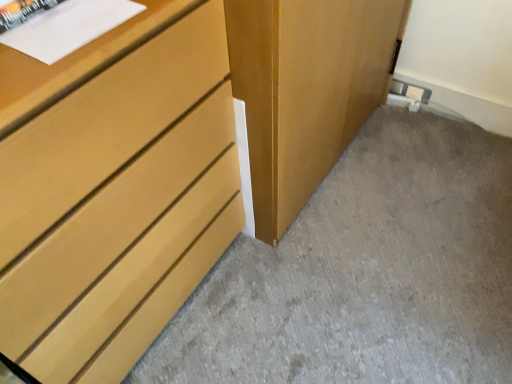
Question: From a real-world perspective, is matte wood dresser at lower left physically located above or below matte wood chest of drawers at left?

Choices:
 (A) above
 (B) below

Answer: (B)

Question: Based on their sizes in the image, would you say matte wood dresser at lower left is bigger or smaller than matte wood chest of drawers at left?

Choices:
 (A) small
 (B) big

Answer: (A)

Question: Relative to matte wood chest of drawers at left, is matte wood dresser at lower left in front or behind?

Choices:
 (A) behind
 (B) front

Answer: (A)

Question: From the image's perspective, relative to matte wood dresser at lower left, is matte wood chest of drawers at left above or below?

Choices:
 (A) below
 (B) above

Answer: (B)

Question: Relative to matte wood dresser at lower left, is matte wood chest of drawers at left in front or behind?

Choices:
 (A) behind
 (B) front

Answer: (B)

Question: Considering the positions of matte wood chest of drawers at left and matte wood dresser at lower left in the image, is matte wood chest of drawers at left bigger or smaller than matte wood dresser at lower left?

Choices:
 (A) small
 (B) big

Answer: (B)

Question: In terms of width, does matte wood chest of drawers at left look wider or thinner when compared to matte wood dresser at lower left?

Choices:
 (A) wide
 (B) thin

Answer: (B)